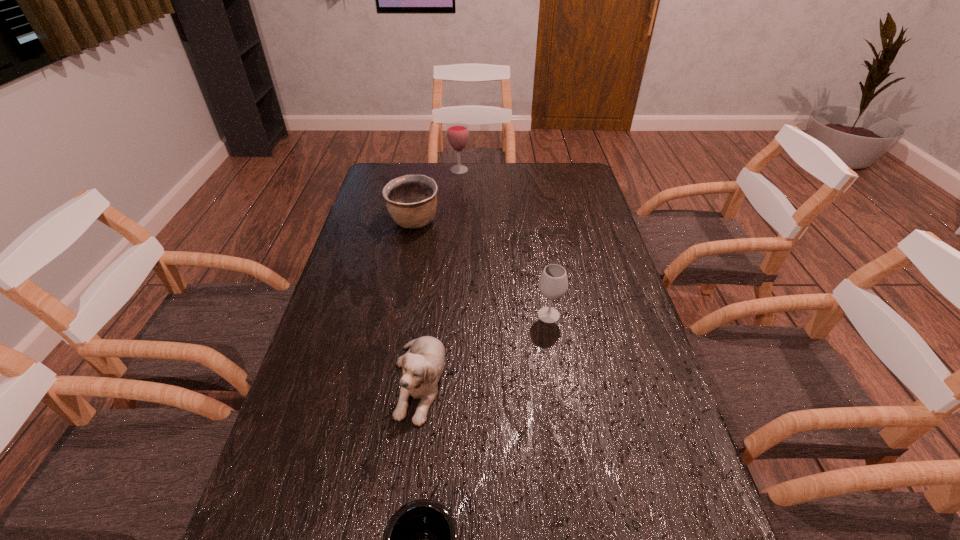
You are a GUI agent. You are given a task and a screenshot of the screen. Output one action in this format:
    pyautogui.click(x=<x>, y=<y>)
    Task: Click on the object that is at the far edge
    This screenshot has width=960, height=540.
    Given the screenshot: What is the action you would take?
    pyautogui.click(x=457, y=132)

At what (x,y) coordinates should I click in order to perform the action: click on object that is at the left edge. Please return your answer as a coordinate pair (x, y). The height and width of the screenshot is (540, 960). Looking at the image, I should click on (411, 200).

The image size is (960, 540). In the image, there is a desktop. What are the coordinates of `free space at the far edge` in the screenshot? It's located at pyautogui.click(x=477, y=175).

At what (x,y) coordinates should I click in order to perform the action: click on vacant area at the left edge of the desktop. Please return your answer as a coordinate pair (x, y). This screenshot has width=960, height=540. Looking at the image, I should click on (368, 210).

In the image, there is a desktop. In order to click on vacant space at the right edge in this screenshot , I will do `click(693, 491)`.

Locate an element on the screen. Image resolution: width=960 pixels, height=540 pixels. vacant space at the far left corner of the desktop is located at coordinates (389, 165).

Where is `blank space at the far right corner of the desktop`? This screenshot has height=540, width=960. blank space at the far right corner of the desktop is located at coordinates (572, 172).

At what (x,y) coordinates should I click in order to perform the action: click on free spot between the puppy and the left wineglass. Please return your answer as a coordinate pair (x, y). Image resolution: width=960 pixels, height=540 pixels. Looking at the image, I should click on (439, 275).

Where is `vacant area between the pottery and the nearer wineglass`? vacant area between the pottery and the nearer wineglass is located at coordinates (481, 268).

At what (x,y) coordinates should I click in order to perform the action: click on vacant area that lies between the shorter wineglass and the second farthest object. Please return your answer as a coordinate pair (x, y). The image size is (960, 540). Looking at the image, I should click on (481, 268).